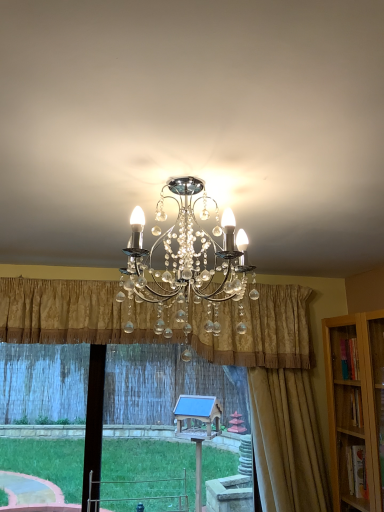
Question: In terms of width, does transparent glass window at center look wider or thinner when compared to gold textured curtain at right, which is the 2th curtain from left to right?

Choices:
 (A) thin
 (B) wide

Answer: (A)

Question: Is transparent glass window at center bigger or smaller than gold textured curtain at right, which is the 2th curtain from left to right?

Choices:
 (A) small
 (B) big

Answer: (B)

Question: Estimate the real-world distances between objects in this image. Which object is farther from the gold textured curtain at right, which ranks as the first curtain in right-to-left order?

Choices:
 (A) gold textured curtain at center, marked as the 2th curtain in a right-to-left arrangement
 (B) transparent glass window at center

Answer: (B)

Question: Which object is positioned closest to the transparent glass window at center?

Choices:
 (A) gold textured curtain at right, which ranks as the first curtain in right-to-left order
 (B) gold textured curtain at center, positioned as the first curtain in left-to-right order

Answer: (A)